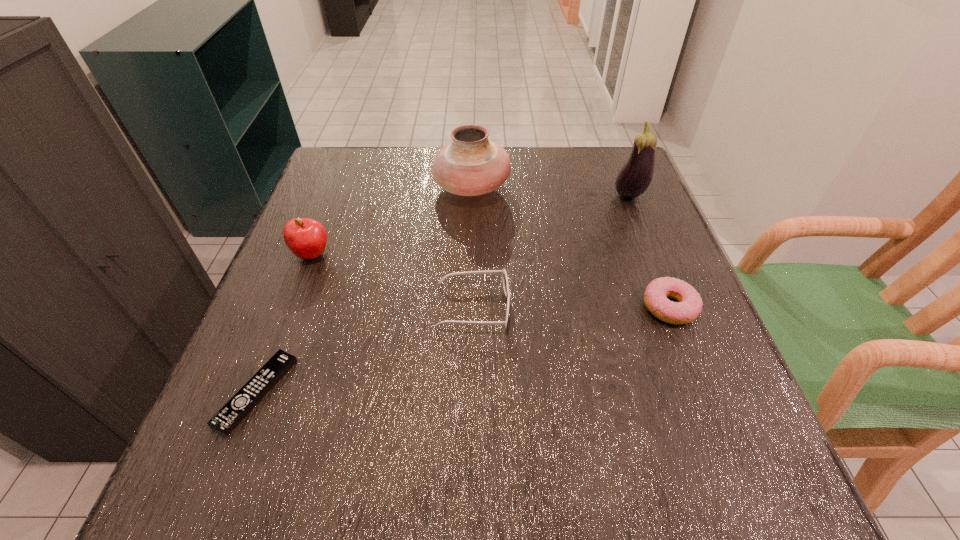
This screenshot has height=540, width=960. In order to click on free space located on the right of the third tallest object in this screenshot , I will do `click(359, 254)`.

Image resolution: width=960 pixels, height=540 pixels. Find the location of `free region located with the lenses of the sunglasses facing outward`. free region located with the lenses of the sunglasses facing outward is located at coordinates (691, 306).

Find the location of a particular element. The width and height of the screenshot is (960, 540). free spot located 0.050m on the back of the doughnut is located at coordinates (655, 269).

Identify the location of vacant point located on the right of the nearest object. (507, 392).

Locate an element on the screen. eggplant that is positioned at the far edge is located at coordinates (634, 178).

Locate an element on the screen. Image resolution: width=960 pixels, height=540 pixels. pottery that is at the far edge is located at coordinates (470, 165).

Identify the location of apple located in the left edge section of the desktop. (306, 238).

Image resolution: width=960 pixels, height=540 pixels. Find the location of `remote control present at the left edge`. remote control present at the left edge is located at coordinates (242, 403).

I want to click on eggplant at the right edge, so click(634, 178).

Locate an element on the screen. doughnut that is at the right edge is located at coordinates (689, 306).